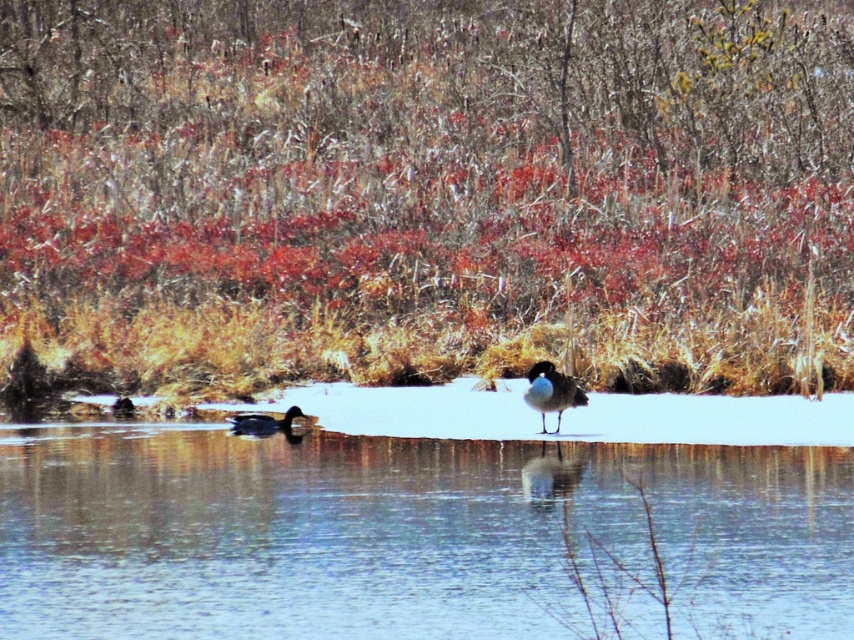
Question: Based on their relative distances, which object is farther from the clear ice at center?

Choices:
 (A) shiny black duck at lower left
 (B) brown grass at center
 (C) white glossy duck at center

Answer: (B)

Question: Which is farther from the brown grass at center?

Choices:
 (A) shiny black duck at lower left
 (B) white glossy duck at center
 (C) clear ice at center

Answer: (C)

Question: Can you confirm if brown grass at center is positioned to the left of shiny black duck at lower left?

Choices:
 (A) yes
 (B) no

Answer: (B)

Question: Can you confirm if brown grass at center is positioned to the right of clear ice at center?

Choices:
 (A) yes
 (B) no

Answer: (A)

Question: Does clear ice at center have a larger size compared to white glossy duck at center?

Choices:
 (A) yes
 (B) no

Answer: (B)

Question: Which point is farther from the camera taking this photo?

Choices:
 (A) (243, 417)
 (B) (576, 403)
 (C) (611, 371)

Answer: (C)